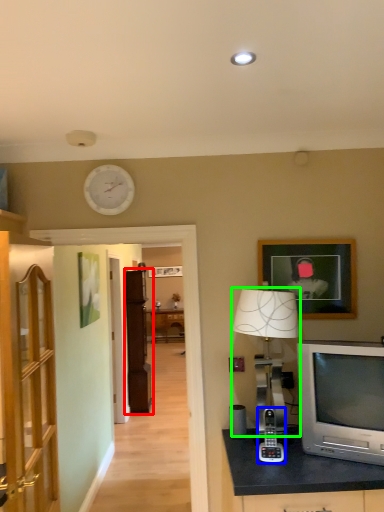
Question: Estimate the real-world distances between objects in this image. Which object is farther from cabinetry (highlighted by a red box), gadget (highlighted by a blue box) or table lamp (highlighted by a green box)?

Choices:
 (A) gadget
 (B) table lamp

Answer: (B)